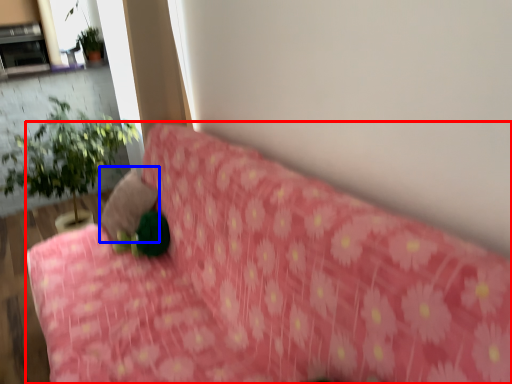
Question: Among these objects, which one is nearest to the camera, furniture (highlighted by a red box) or pillow (highlighted by a blue box)?

Choices:
 (A) furniture
 (B) pillow

Answer: (A)